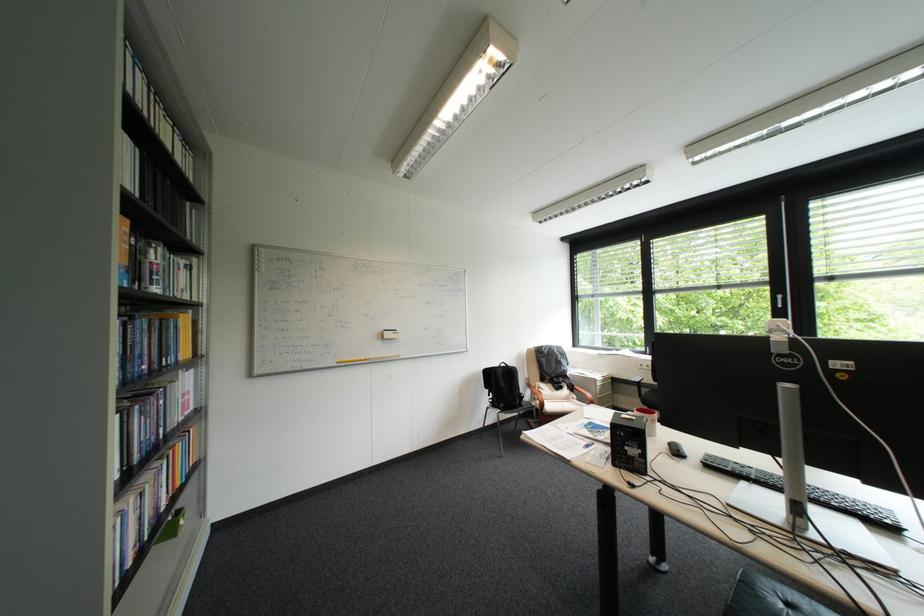
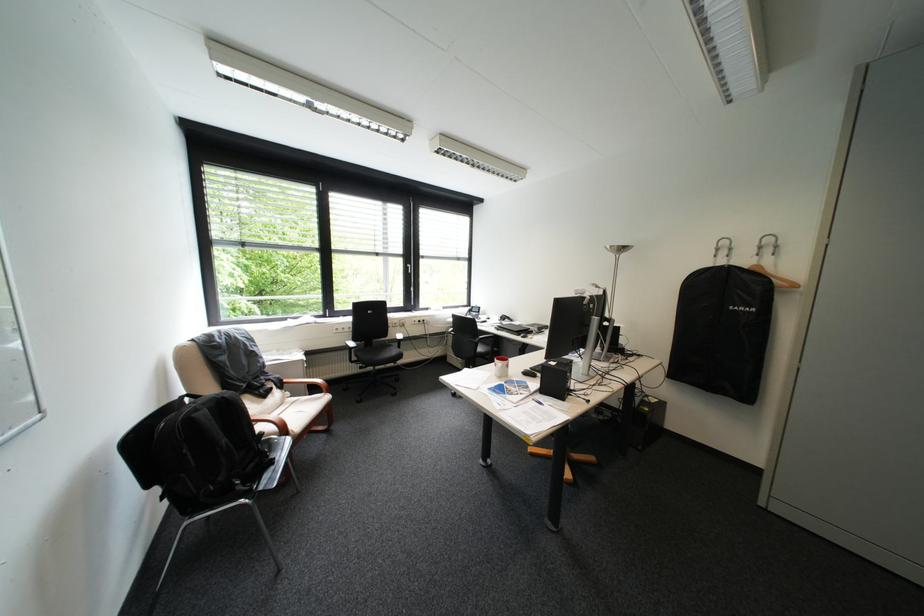
Locate, in the second image, the point that corresponds to point (524, 369) in the first image.

(236, 398)